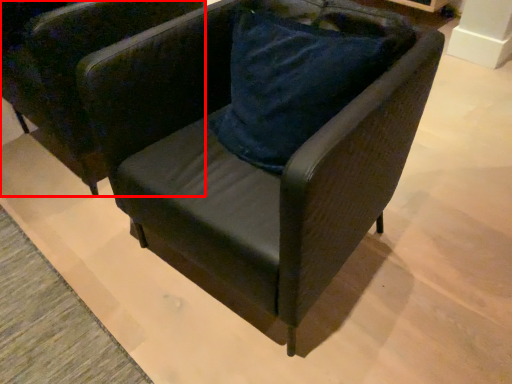
Question: From the image's perspective, where is chair (annotated by the red box) located in relation to chair in the image?

Choices:
 (A) below
 (B) above

Answer: (B)